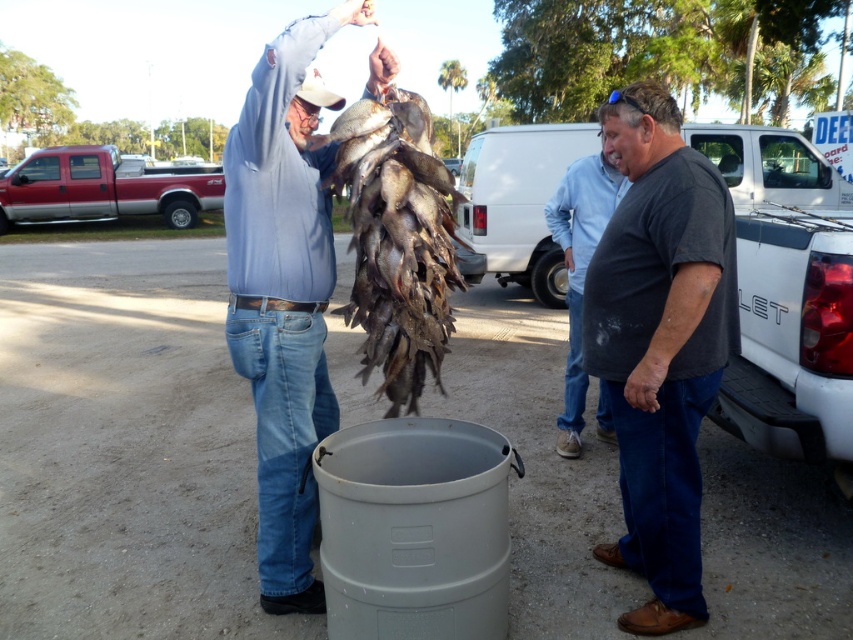
Can you confirm if dark gray t-shirt at right is bigger than dark brown scales at upper center?

Correct, dark gray t-shirt at right is larger in size than dark brown scales at upper center.

Which is above, dark gray t-shirt at right or dark brown scales at upper center?

dark brown scales at upper center is higher up.

The image size is (853, 640). Identify the location of dark gray t-shirt at right. (660, 342).

Between point (688, 500) and point (200, 170), which one is positioned behind?

Point (200, 170)

Does dark gray t-shirt at right have a greater height compared to red metallic pickup truck at left?

Yes, dark gray t-shirt at right is taller than red metallic pickup truck at left.

Where is `dark gray t-shirt at right`? Image resolution: width=853 pixels, height=640 pixels. dark gray t-shirt at right is located at coordinates point(660,342).

Who is more distant from viewer, [669,608] or [566,177]?

Positioned behind is point [566,177].

Image resolution: width=853 pixels, height=640 pixels. In order to click on dark gray t-shirt at right in this screenshot , I will do pyautogui.click(x=660, y=342).